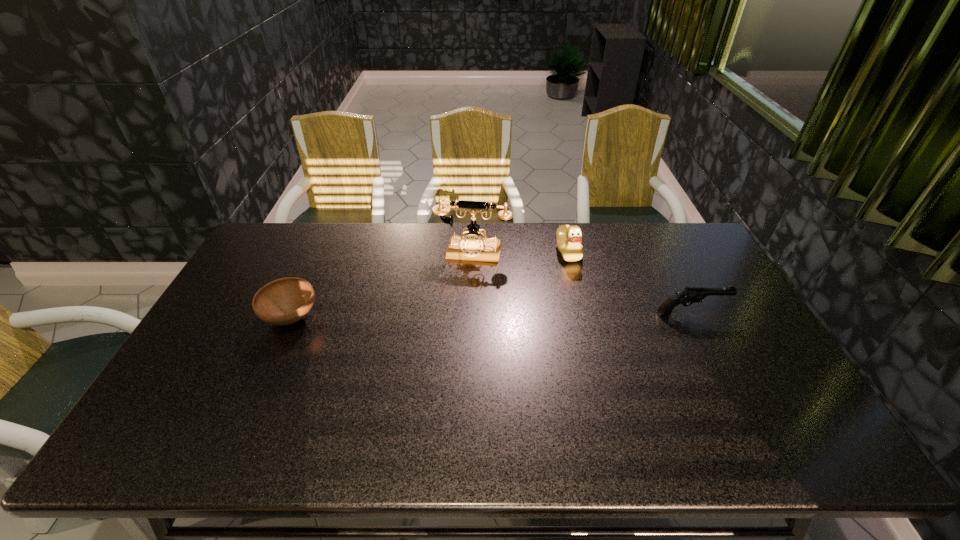
At what (x,y) coordinates should I click in order to perform the action: click on free region at the near edge of the desktop. Please return your answer as a coordinate pair (x, y). Looking at the image, I should click on (657, 387).

What are the coordinates of `free space at the left edge of the desktop` in the screenshot? It's located at [x=237, y=374].

You are a GUI agent. You are given a task and a screenshot of the screen. Output one action in this format:
    pyautogui.click(x=<x>, y=<y>)
    Task: Click on the vacant space at the right edge of the desktop
    The image size is (960, 540).
    Given the screenshot: What is the action you would take?
    pyautogui.click(x=747, y=352)

The width and height of the screenshot is (960, 540). Identify the location of vacant space at the far left corner of the desktop. (273, 236).

The image size is (960, 540). Identify the location of empty location between the tallest object and the duck. (520, 252).

Image resolution: width=960 pixels, height=540 pixels. I want to click on free space between the third tallest object and the telephone, so click(582, 283).

Identify the location of free spot between the tallest object and the shortest object. This screenshot has height=540, width=960. (382, 285).

Identify the location of vacant space that is in between the shortest object and the third object from left to right. The image size is (960, 540). (430, 285).

Where is `blank region between the second object from left to right and the leftmost object`? The image size is (960, 540). blank region between the second object from left to right and the leftmost object is located at coordinates (382, 285).

In order to click on free point between the duck and the telephone in this screenshot , I will do `click(520, 252)`.